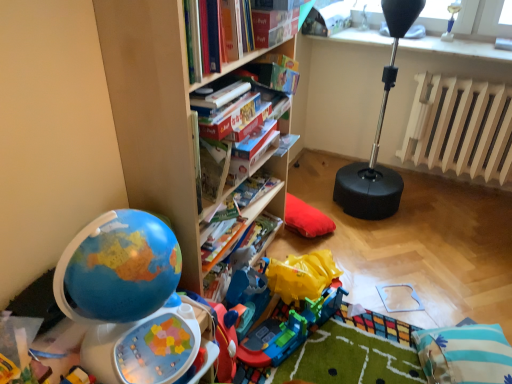
Question: Is blue striped pillow at lower right taller than wooden bookshelf at center?

Choices:
 (A) no
 (B) yes

Answer: (A)

Question: Is blue striped pillow at lower right further to the viewer compared to wooden bookshelf at center?

Choices:
 (A) yes
 (B) no

Answer: (A)

Question: Considering the relative sizes of blue striped pillow at lower right and wooden bookshelf at center in the image provided, is blue striped pillow at lower right shorter than wooden bookshelf at center?

Choices:
 (A) no
 (B) yes

Answer: (B)

Question: Would you say blue striped pillow at lower right is outside wooden bookshelf at center?

Choices:
 (A) yes
 (B) no

Answer: (A)

Question: Would you say blue striped pillow at lower right is a long distance from wooden bookshelf at center?

Choices:
 (A) no
 (B) yes

Answer: (B)

Question: Is wooden bookshelf at center wider or thinner than hardcover book at center, marked as the first paperback book in a back-to-front arrangement?

Choices:
 (A) thin
 (B) wide

Answer: (B)

Question: From the image's perspective, is wooden bookshelf at center positioned above or below hardcover book at center, marked as the first paperback book in a back-to-front arrangement?

Choices:
 (A) below
 (B) above

Answer: (A)

Question: Is wooden bookshelf at center spatially inside hardcover book at center, the 2th paperback book when ordered from front to back, or outside of it?

Choices:
 (A) outside
 (B) inside

Answer: (A)

Question: Is wooden bookshelf at center taller or shorter than hardcover book at center, marked as the first paperback book in a back-to-front arrangement?

Choices:
 (A) tall
 (B) short

Answer: (A)

Question: Considering the positions of wooden radiator at right and hardcover book at center in the image, is wooden radiator at right taller or shorter than hardcover book at center?

Choices:
 (A) tall
 (B) short

Answer: (A)

Question: Looking at their shapes, would you say wooden radiator at right is wider or thinner than hardcover book at center?

Choices:
 (A) thin
 (B) wide

Answer: (B)

Question: Is wooden radiator at right inside the boundaries of hardcover book at center, or outside?

Choices:
 (A) outside
 (B) inside

Answer: (A)

Question: From the image's perspective, is wooden radiator at right above or below hardcover book at center?

Choices:
 (A) above
 (B) below

Answer: (A)

Question: In terms of size, does hardcover book at center, the second paperback book in the back-to-front sequence, appear bigger or smaller than blue striped pillow at lower right?

Choices:
 (A) big
 (B) small

Answer: (B)

Question: In terms of width, does hardcover book at center, which ranks as the 1th paperback book in front-to-back order, look wider or thinner when compared to blue striped pillow at lower right?

Choices:
 (A) thin
 (B) wide

Answer: (A)